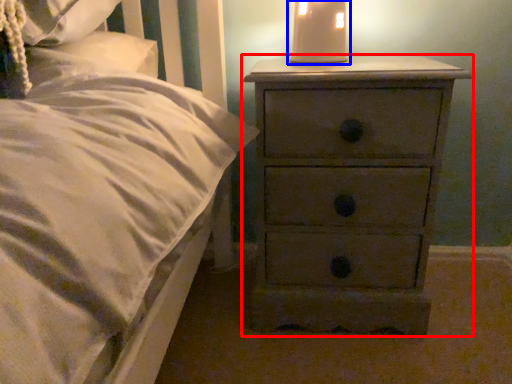
Question: Which of the following is the closest to the observer, chest of drawers (highlighted by a red box) or bedside lamp (highlighted by a blue box)?

Choices:
 (A) chest of drawers
 (B) bedside lamp

Answer: (A)